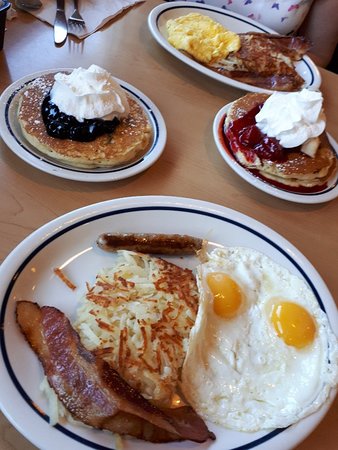
Find the location of a particular element. The width and height of the screenshot is (338, 450). fork is located at coordinates (76, 28).